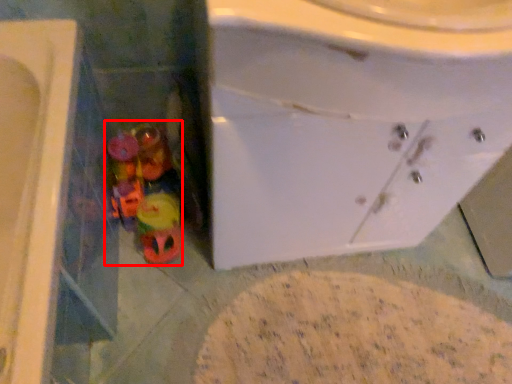
Question: From the image's perspective, where is toy (annotated by the red box) located in relation to sink in the image?

Choices:
 (A) above
 (B) below

Answer: (B)